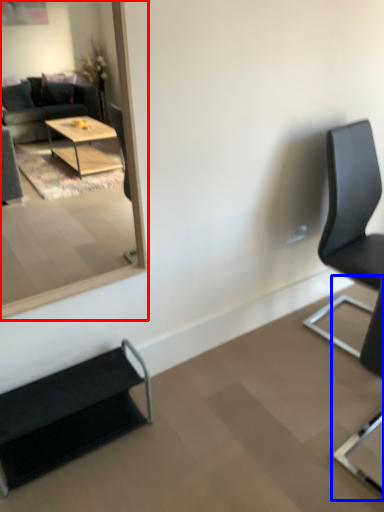
Question: Which object appears closest to the camera in this image, mirror (highlighted by a red box) or chair (highlighted by a blue box)?

Choices:
 (A) mirror
 (B) chair

Answer: (B)